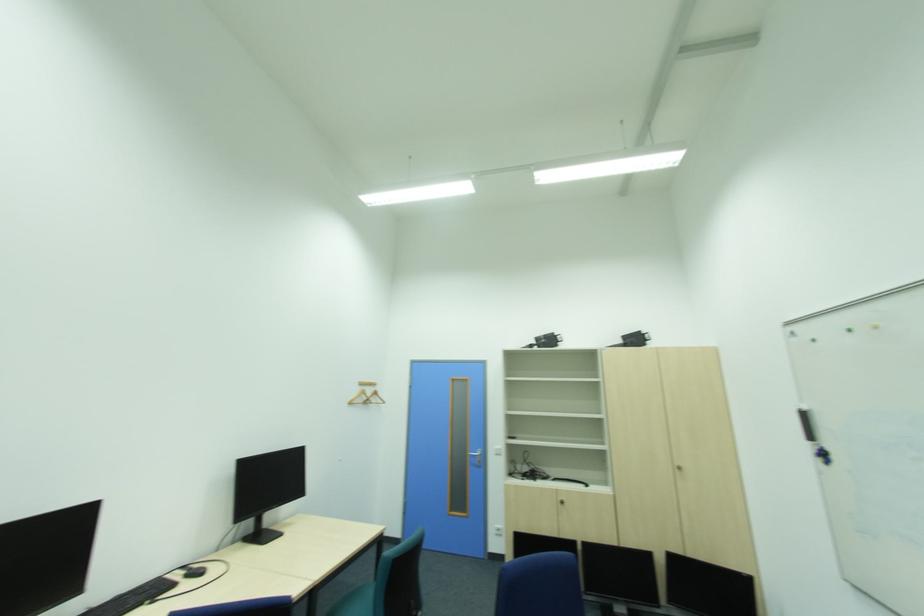
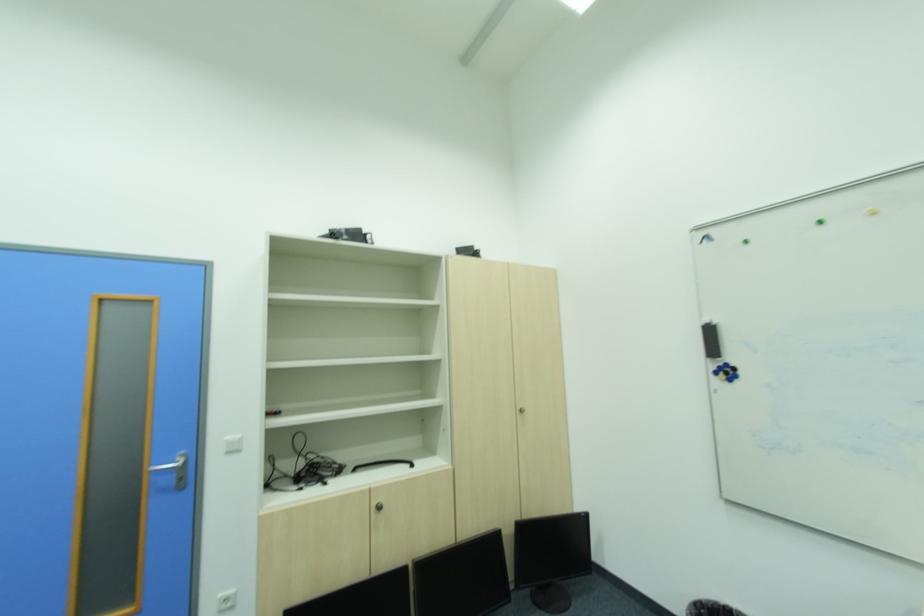
Find the pixel in the second image that matches point (830, 455) in the first image.

(736, 371)